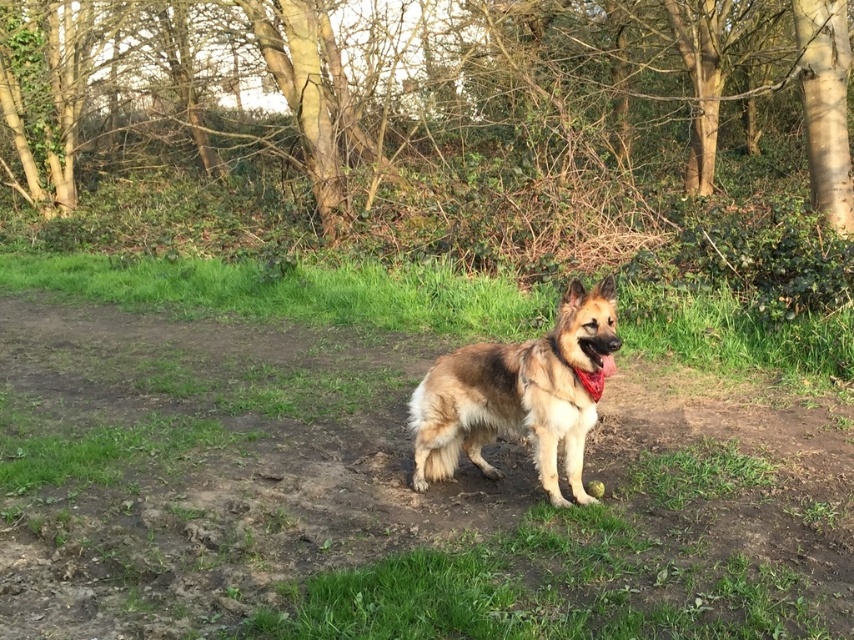
Question: Which object is closer to the camera taking this photo?

Choices:
 (A) brown bark tree at center
 (B) brown fur dog at center
 (C) green grass at center

Answer: (B)

Question: Does brown bark tree at center appear over green grass at center?

Choices:
 (A) no
 (B) yes

Answer: (B)

Question: Which object is positioned closest to the brown fur dog at center?

Choices:
 (A) red fabric neckband at center
 (B) green grass at center
 (C) brown bark tree at center

Answer: (A)

Question: In this image, where is green grass at center located relative to brown fur dog at center?

Choices:
 (A) left
 (B) right

Answer: (A)

Question: Is brown bark tree at center thinner than red fabric neckband at center?

Choices:
 (A) no
 (B) yes

Answer: (A)

Question: Which point is farther to the camera?

Choices:
 (A) brown fur dog at center
 (B) green grass at center
 (C) red fabric neckband at center

Answer: (B)